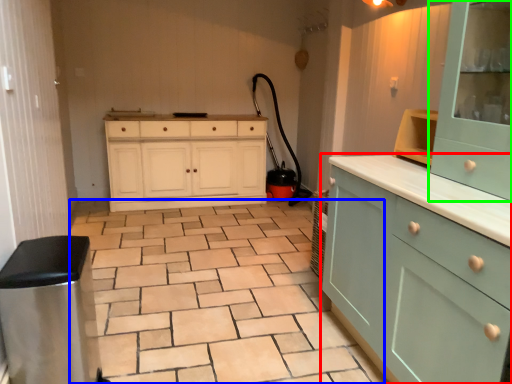
Question: Which is farther away from cabinetry (highlighted by a red box)? ceramic tile (highlighted by a blue box) or cabinetry (highlighted by a green box)?

Choices:
 (A) ceramic tile
 (B) cabinetry

Answer: (A)